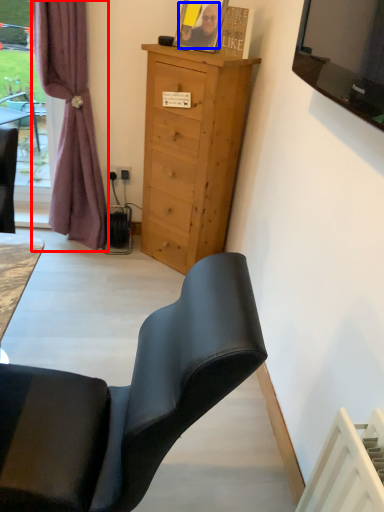
Question: Among these objects, which one is nearest to the camera, curtain (highlighted by a red box) or person (highlighted by a blue box)?

Choices:
 (A) curtain
 (B) person

Answer: (A)